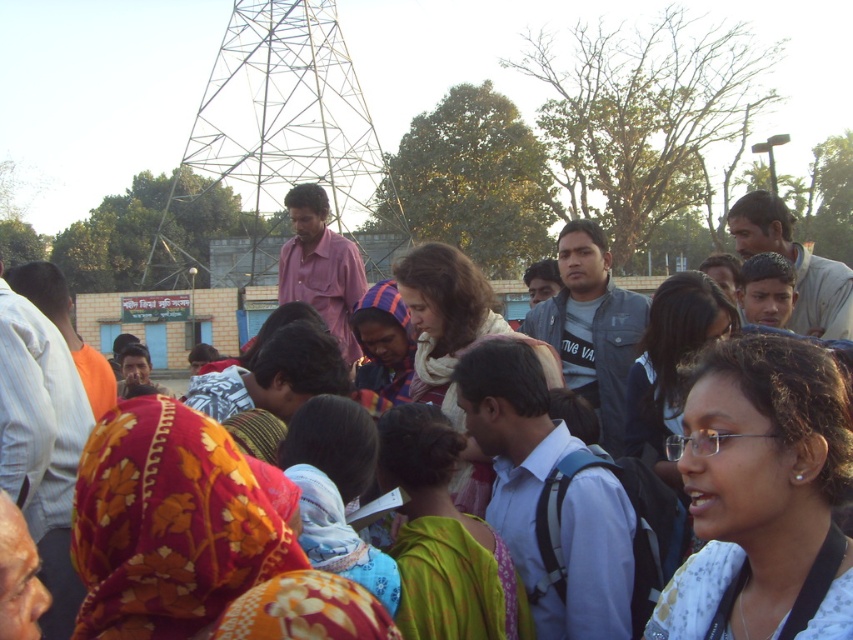
From the picture: How much distance is there between white fabric at center and multicolored fabric headscarf at center?

white fabric at center is 42.01 meters away from multicolored fabric headscarf at center.

Does white fabric at center have a greater width compared to multicolored fabric headscarf at center?

Yes.

Does point (825, 509) lie behind point (392, 300)?

No, it is not.

Where is `white fabric at center`? white fabric at center is located at coordinates (762, 497).

Can you confirm if multicolored fabric at center is shorter than multicolored fabric headscarf at center?

No.

Who is more distant from viewer, (x=688, y=296) or (x=375, y=358)?

Positioned behind is point (x=375, y=358).

Is point (567, 280) positioned in front of point (370, 289)?

No, (567, 280) is behind (370, 289).

The width and height of the screenshot is (853, 640). Identify the location of multicolored fabric at center. (581, 257).

Is green floral sari at center to the right of multicolored fabric headscarf at center from the viewer's perspective?

Correct, you'll find green floral sari at center to the right of multicolored fabric headscarf at center.

Who is higher up, green floral sari at center or multicolored fabric headscarf at center?

Positioned higher is multicolored fabric headscarf at center.

Which is behind, point (477, 586) or point (368, 380)?

The point (368, 380) is more distant.

Locate an element on the screen. green floral sari at center is located at coordinates (444, 540).